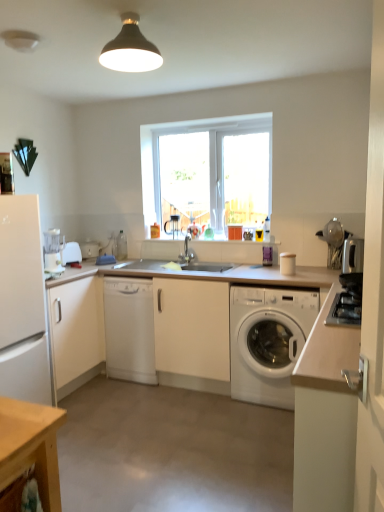
This screenshot has width=384, height=512. What are the coordinates of `vacant area on top of matte black lampshade at upper center (from a real-world perspective)` in the screenshot? It's located at (135, 11).